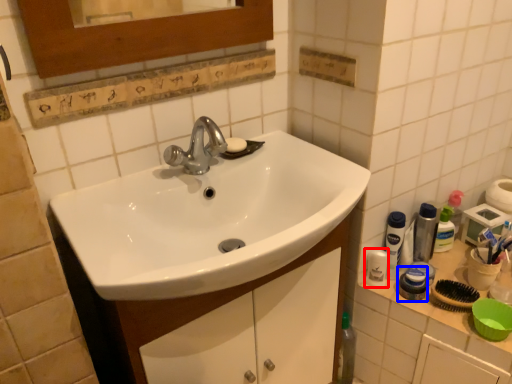
Question: Which of the following is the closest to the observer, mouthwash (highlighted by a red box) or mouthwash (highlighted by a blue box)?

Choices:
 (A) mouthwash
 (B) mouthwash

Answer: (B)